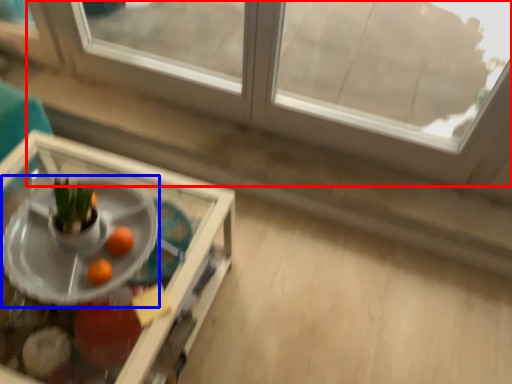
Question: Which object is further to the camera taking this photo, window (highlighted by a red box) or table (highlighted by a blue box)?

Choices:
 (A) window
 (B) table

Answer: (A)